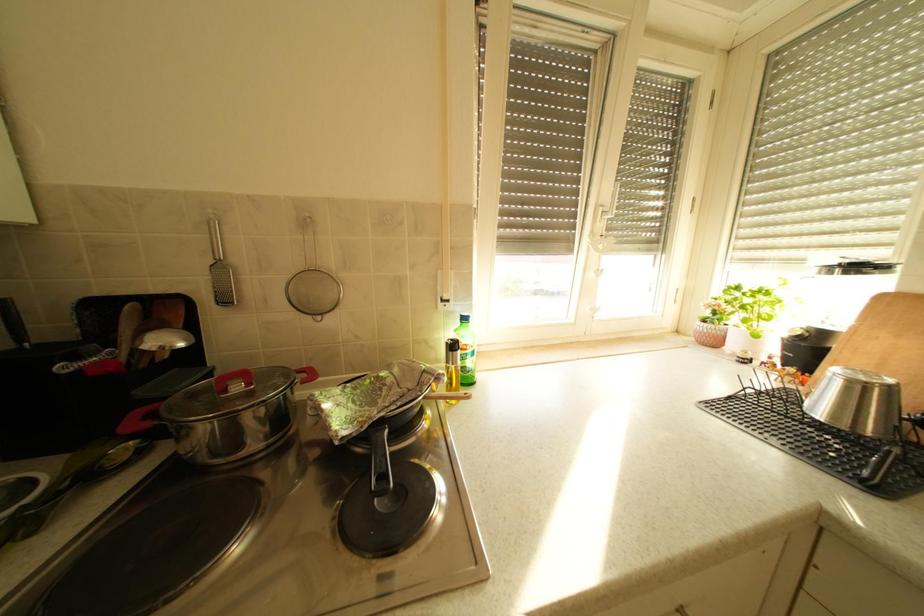
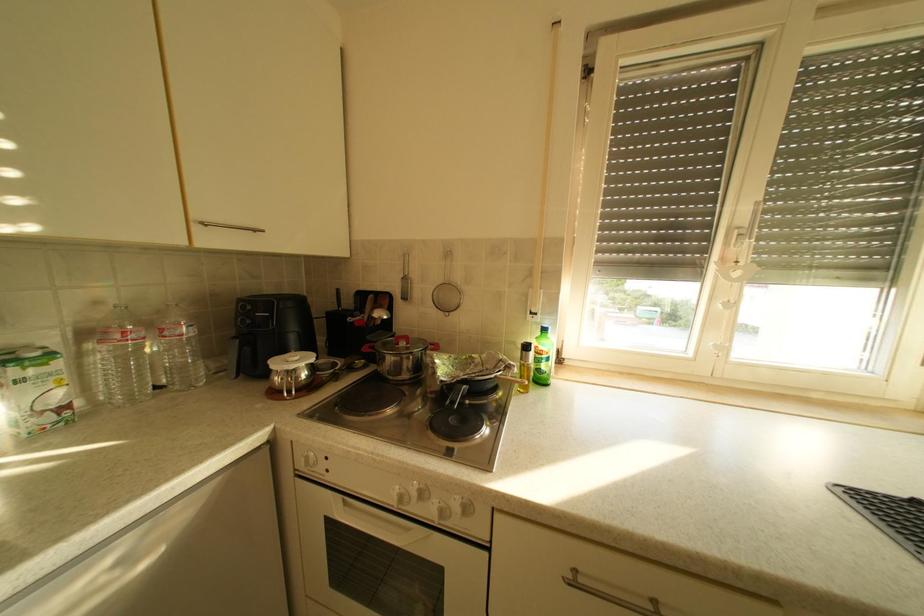
Question: The camera is either moving clockwise (left) or counter-clockwise (right) around the object. The first image is from the beginning of the video and the second image is from the end. Is the camera moving left or right when shooting the video?

Choices:
 (A) Left
 (B) Right

Answer: (B)